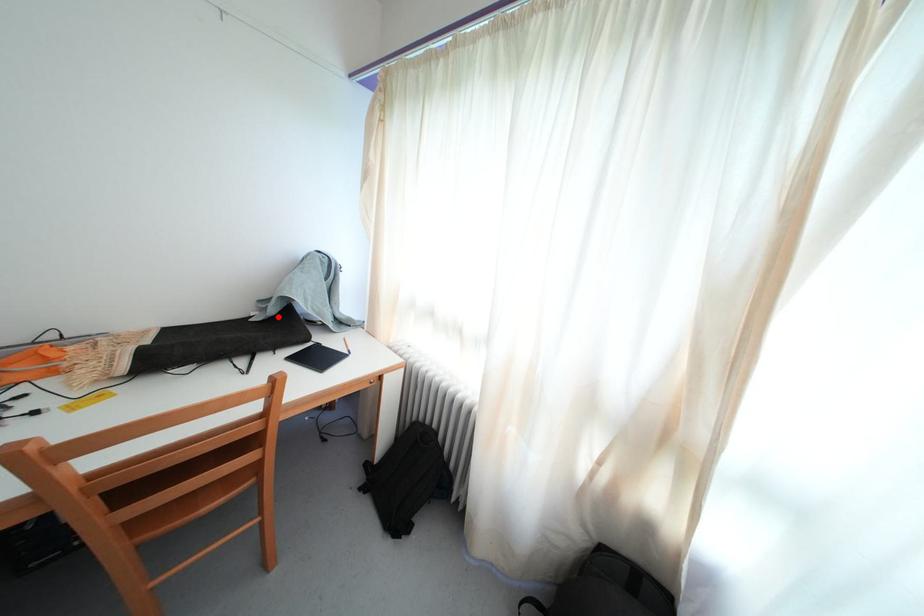
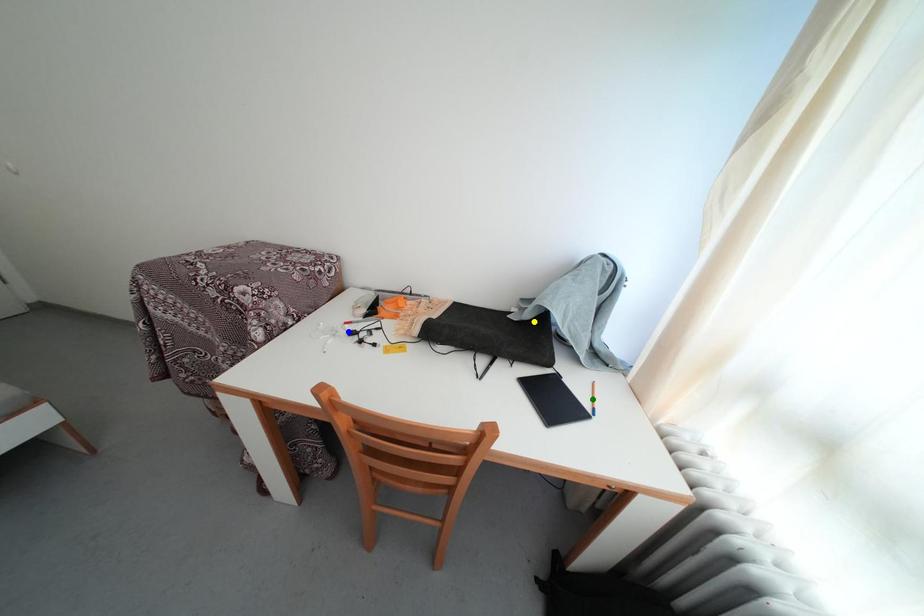
Question: I am providing you with two images of the same scene from different viewpoints. A red point is marked on the first image. You are given multiple points on the second image. Which spot in image 2 lines up with the point in image 1?

Choices:
 (A) blue point
 (B) yellow point
 (C) green point

Answer: (B)